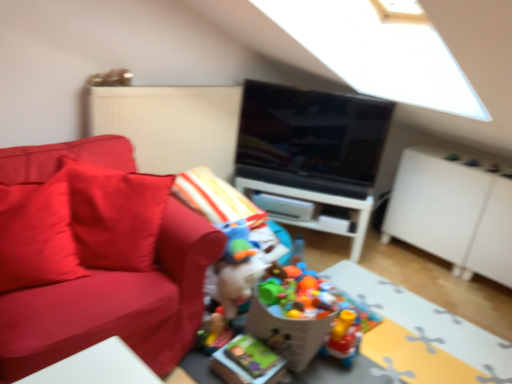
Locate an element on the screen. This screenshot has width=512, height=384. free space in front of white matte dresser at right is located at coordinates (453, 288).